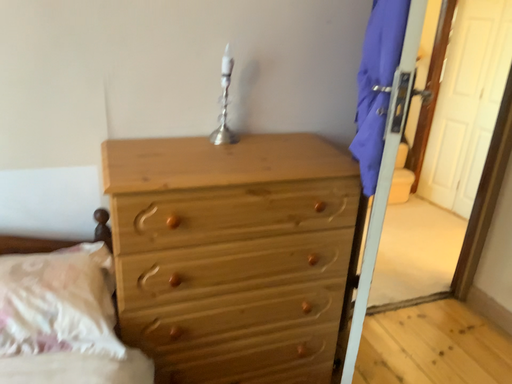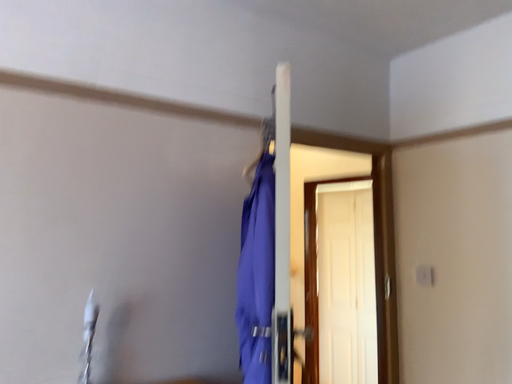
Question: How did the camera likely rotate when shooting the video?

Choices:
 (A) rotated right
 (B) rotated left

Answer: (A)